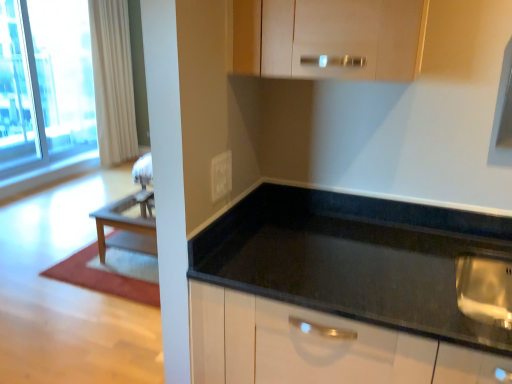
Question: Is transparent glass window at upper left positioned far away from white glossy electric outlet at center?

Choices:
 (A) no
 (B) yes

Answer: (B)

Question: Is transparent glass window at upper left touching white glossy electric outlet at center?

Choices:
 (A) no
 (B) yes

Answer: (A)

Question: Does transparent glass window at upper left appear on the left side of white glossy electric outlet at center?

Choices:
 (A) yes
 (B) no

Answer: (A)

Question: Is transparent glass window at upper left in front of white glossy electric outlet at center?

Choices:
 (A) no
 (B) yes

Answer: (A)

Question: Is transparent glass window at upper left not within white glossy electric outlet at center?

Choices:
 (A) no
 (B) yes

Answer: (B)

Question: From their relative heights in the image, would you say transparent glass window at upper left is taller or shorter than matte wood cabinet at upper center?

Choices:
 (A) short
 (B) tall

Answer: (B)

Question: From the image's perspective, is transparent glass window at upper left positioned above or below matte wood cabinet at upper center?

Choices:
 (A) below
 (B) above

Answer: (B)

Question: Is transparent glass window at upper left to the left or to the right of matte wood cabinet at upper center in the image?

Choices:
 (A) right
 (B) left

Answer: (B)

Question: In terms of width, does transparent glass window at upper left look wider or thinner when compared to matte wood cabinet at upper center?

Choices:
 (A) thin
 (B) wide

Answer: (A)

Question: Is transparent glass window at upper left spatially inside white glossy electric outlet at center, or outside of it?

Choices:
 (A) outside
 (B) inside

Answer: (A)

Question: From the image's perspective, is transparent glass window at upper left positioned above or below white glossy electric outlet at center?

Choices:
 (A) above
 (B) below

Answer: (A)

Question: Is transparent glass window at upper left in front of or behind white glossy electric outlet at center in the image?

Choices:
 (A) behind
 (B) front

Answer: (A)

Question: Does point (71, 31) appear closer or farther from the camera than point (211, 183)?

Choices:
 (A) farther
 (B) closer

Answer: (A)

Question: Relative to black granite countertop at center, is transparent glass window at upper left in front or behind?

Choices:
 (A) front
 (B) behind

Answer: (B)

Question: Do you think transparent glass window at upper left is within black granite countertop at center, or outside of it?

Choices:
 (A) outside
 (B) inside

Answer: (A)